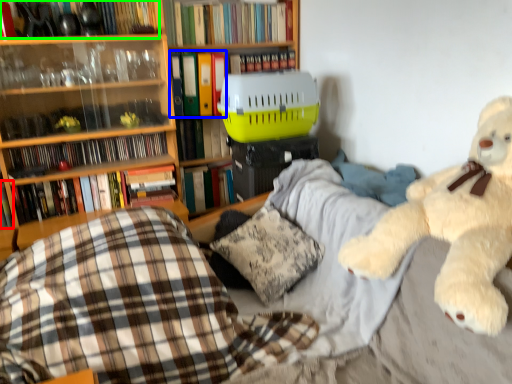
Question: Which is nearer to the book (highlighted by a red box)? book (highlighted by a blue box) or book (highlighted by a green box).

Choices:
 (A) book
 (B) book

Answer: (B)